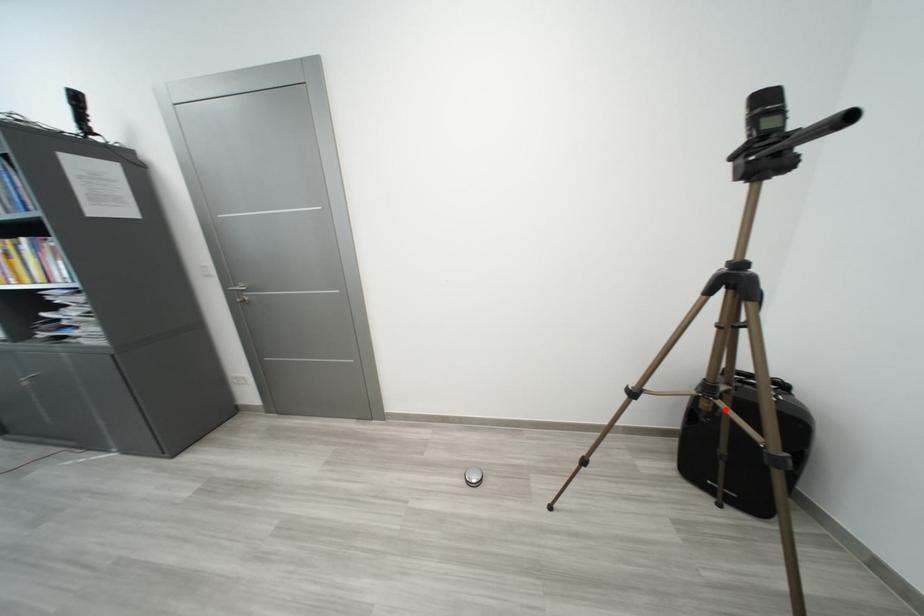
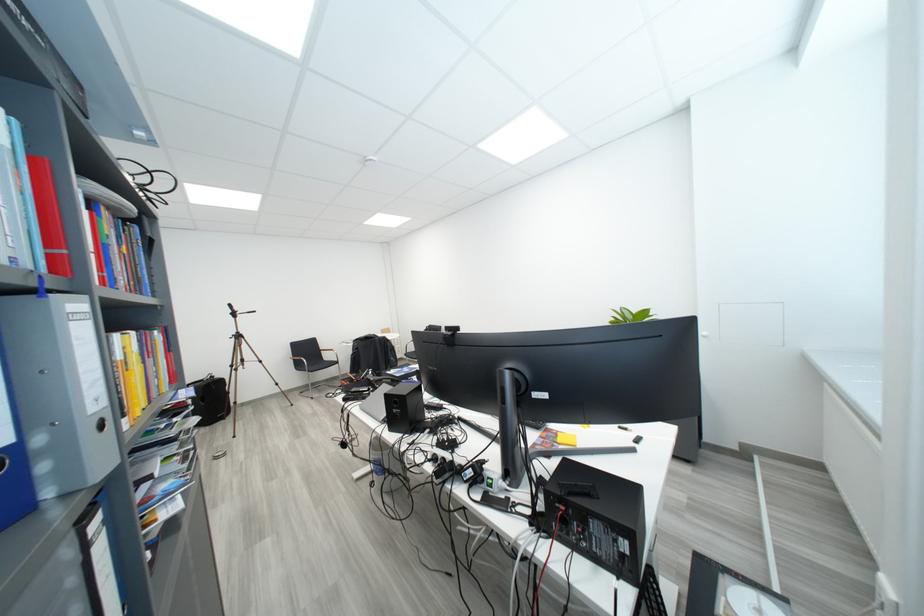
Question: I am providing you with two images of the same scene from different viewpoints. A red point is marked on the first image. Is the red point's position out of view in image 2?

Choices:
 (A) Yes
 (B) No

Answer: (A)